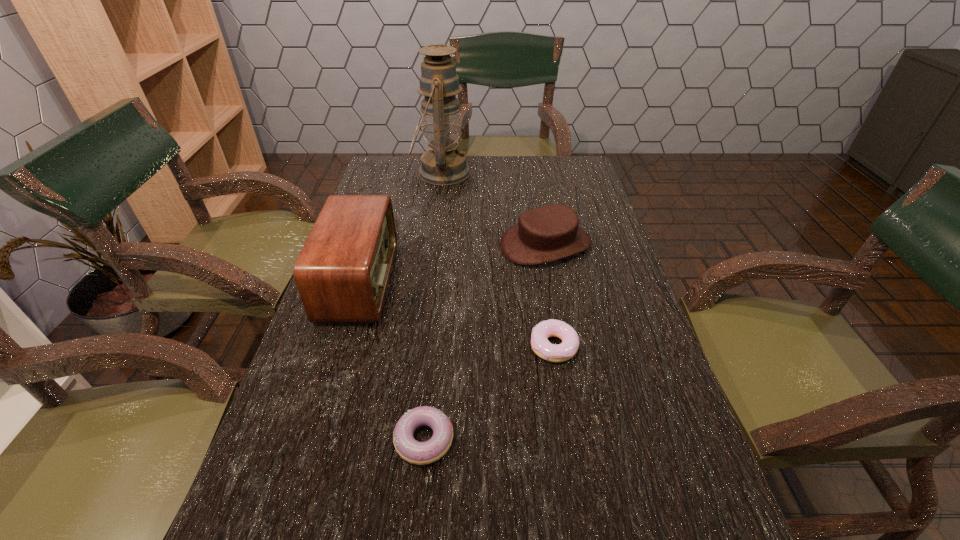
Find the location of `oil lamp`. oil lamp is located at coordinates (445, 164).

The width and height of the screenshot is (960, 540). I want to click on the farthest object, so click(445, 164).

What are the coordinates of `the fourth shortest object` in the screenshot? It's located at (342, 273).

You are a GUI agent. You are given a task and a screenshot of the screen. Output one action in this format:
    pyautogui.click(x=<x>, y=<y>)
    Task: Click on the hat
    
    Given the screenshot: What is the action you would take?
    pyautogui.click(x=549, y=233)

What are the coordinates of `the right doughnut` in the screenshot? It's located at (540, 344).

The image size is (960, 540). Find the location of `the farther doughnut`. the farther doughnut is located at coordinates (540, 344).

Identify the location of the left doughnut. (420, 453).

Where is `the nearer doughnut`? This screenshot has width=960, height=540. the nearer doughnut is located at coordinates (x=420, y=453).

This screenshot has width=960, height=540. I want to click on free point located on the left of the farthest object, so click(376, 173).

Identify the location of free point located 0.260m on the front panel of the radio receiver. (492, 281).